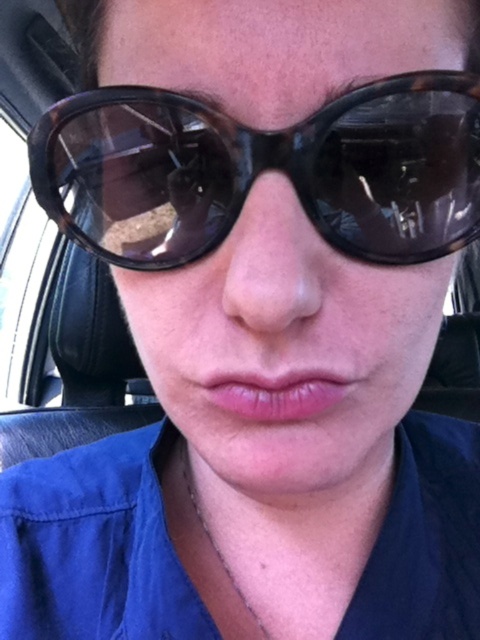
You are a photographer trying to capture a close up of the tortoiseshell sunglasses at center and the pink glossy lips at center. Which object is wider when viewed from your camera lens?

The tortoiseshell sunglasses at center is wider than the pink glossy lips at center.

You are a photographer trying to capture a close up of the person in the car. You want to ensure that both the tortoiseshell sunglasses at center and the pink glossy lips at center are in focus. Based on their positions, which object should you focus on first to ensure both are sharp?

The tortoiseshell sunglasses at center is to the left of pink glossy lips at center. Since they are both at center but offset, focusing on the tortoiseshell sunglasses at center first would allow the pink glossy lips at center to fall within the depth of field, ensuring both are in focus.

You are a photographer trying to capture a close detail shot of the pink glossy lips at center. However, the tortoiseshell sunglasses at center are blocking your view. Can you determine if the sunglasses are in front of the lips based on their positions?

The tortoiseshell sunglasses at center is closer to the viewer than pink glossy lips at center, so yes, the sunglasses are blocking the view of the lips as they are positioned in front of them.